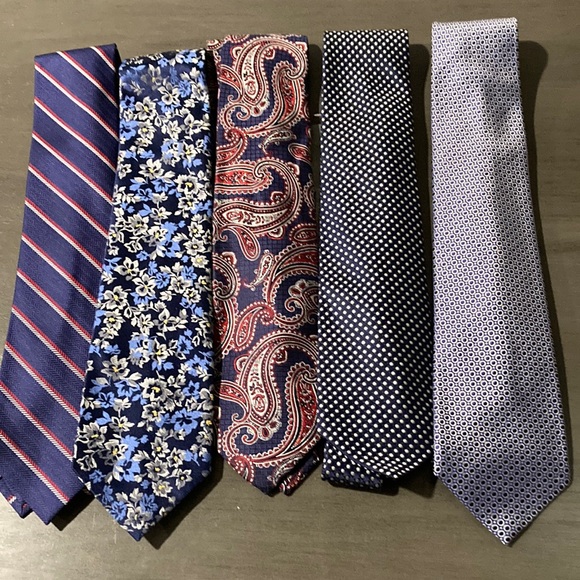
Identify the location of brown table top. Image resolution: width=580 pixels, height=580 pixels. (182, 21).